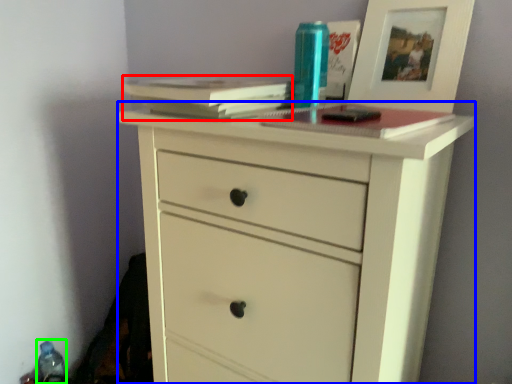
Question: Estimate the real-world distances between objects in this image. Which object is farther from paperback book (highlighted by a red box), chest of drawers (highlighted by a blue box) or bottle (highlighted by a green box)?

Choices:
 (A) chest of drawers
 (B) bottle

Answer: (B)